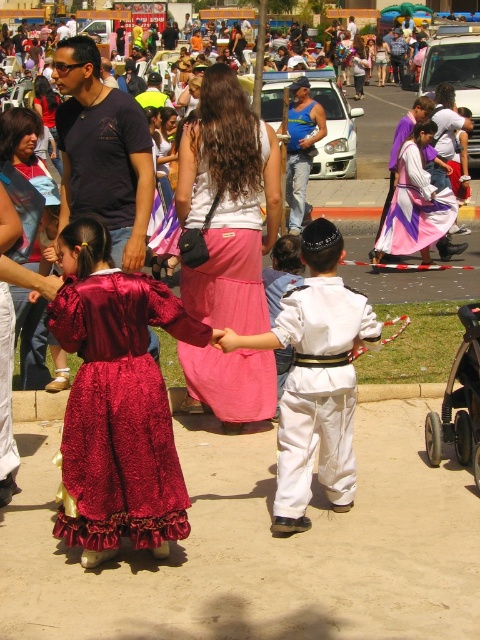
You are a photographer trying to capture a photo of the white cotton outfit at center and the black plastic baby carriage at lower right. Since you want both subjects to appear proportionally sized in the final image, which subject should you move closer to the camera?

To make both the white cotton outfit at center and the black plastic baby carriage at lower right appear proportionally sized in the photo, you should move closer to the black plastic baby carriage at lower right. Since the white cotton outfit at center is larger in size than the baby carriage, moving closer to the smaller object will help balance their sizes in the frame.

Looking at this image, you are a photographer setting up a wide shot for a family portrait. The velvet burgundy dress at lower left and the black plastic baby carriage at lower right are both in the frame. Based on their sizes, which object would appear larger in the photo?

The velvet burgundy dress at lower left might be wider than the black plastic baby carriage at lower right, so it would likely appear larger in the photo.

You are a street performer in the middle of the event. You need to move a 2.0 meter long pole from the velvet burgundy dress at lower left to the black plastic baby carriage at lower right. Can you move it without tilting it?

The velvet burgundy dress at lower left and the black plastic baby carriage at lower right are 1.90 meters apart from each other. Since the pole is 2.0 meters long, it is longer than the distance between them. Therefore, you cannot move the pole horizontally without tilting it.